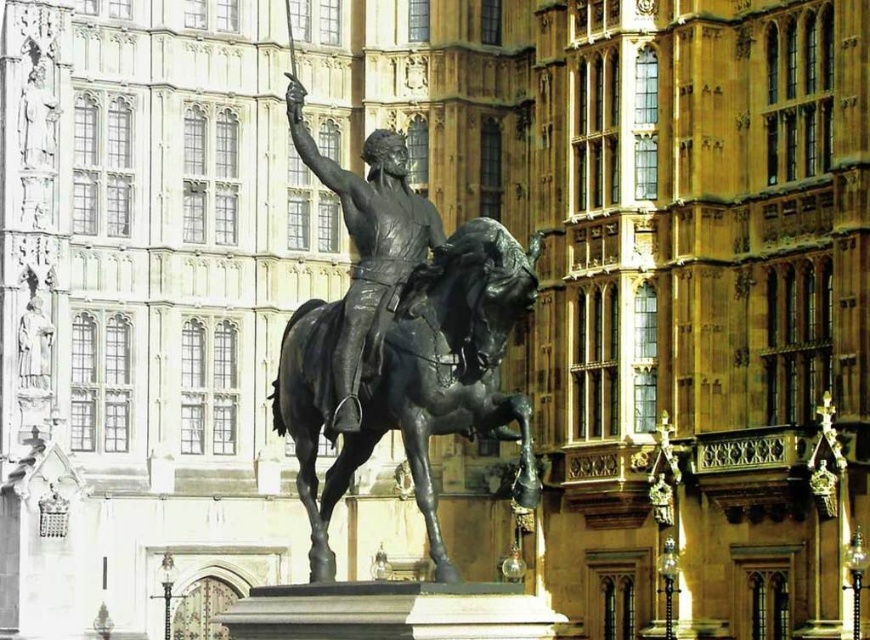
Does point (514, 477) come behind point (300, 109)?

That is True.

Does polished bronze horse at center appear on the left side of polished bronze statue at center?

No, polished bronze horse at center is not to the left of polished bronze statue at center.

Is point (393, 392) positioned after point (382, 236)?

No, (393, 392) is closer to viewer.

The height and width of the screenshot is (640, 870). I want to click on polished bronze horse at center, so click(x=415, y=378).